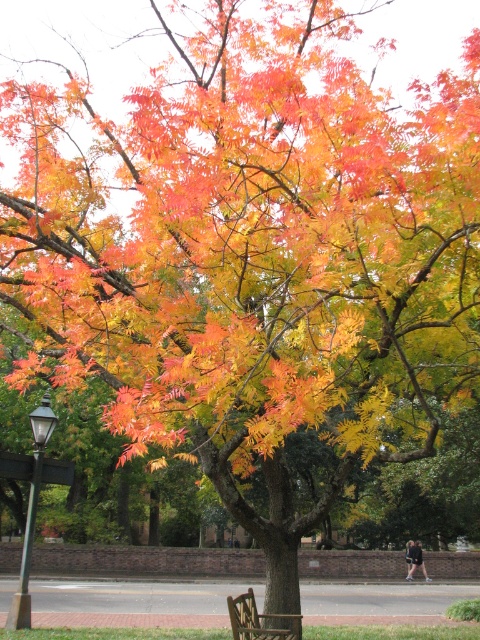
You are a painter setting up your easel to capture the autumn scene. You want to ensure your painting includes both the green metal lamp post at left and the wooden park bench at lower center. Given their heights, which object should you position closer to the bottom of your canvas?

The green metal lamp post at left is shorter than the wooden park bench at lower center, so you should position the green metal lamp post at left closer to the bottom of the canvas to accurately represent their relative heights.

You are designing a new park layout and need to place a wider pathway between the green metal lamp post at left and the wooden park bench at lower center. Which object should you position closer to the pathway to ensure it accommodates the width?

The green metal lamp post at left is thinner than the wooden park bench at lower center, so positioning the green metal lamp post at left closer to the pathway would allow more space for the wider pathway since it takes up less width.

You are standing at the center of the image and want to place a small decorative rock exactly at point (33,499). Which object in the scene is located at that coordinate?

The point (33,499) is on the green metal lamp post at left.